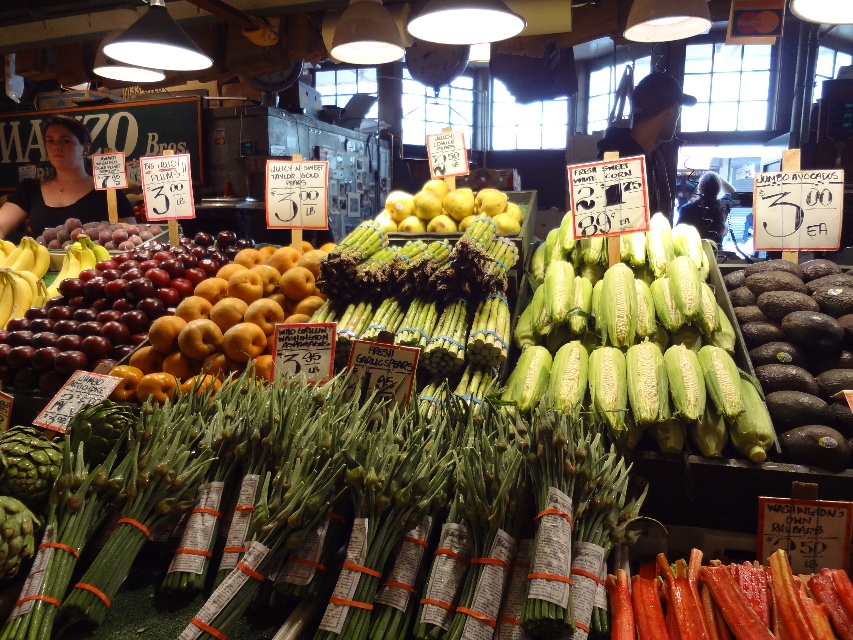
You are a customer at the market and want to grab both the green corn at center and the yellow smooth apples at center. Which one should you reach for first if you want to pick up the lower item first?

The green corn at center is located below the yellow smooth apples at center, so you should reach for the green corn at center first.

You are a customer at the market and want to grab both the green corn at center and the golden yellow peaches at center. Which one should you reach for first if you want to pick up the one that is higher up?

The green corn at center is located above the golden yellow peaches at center, so you should reach for the green corn at center first.